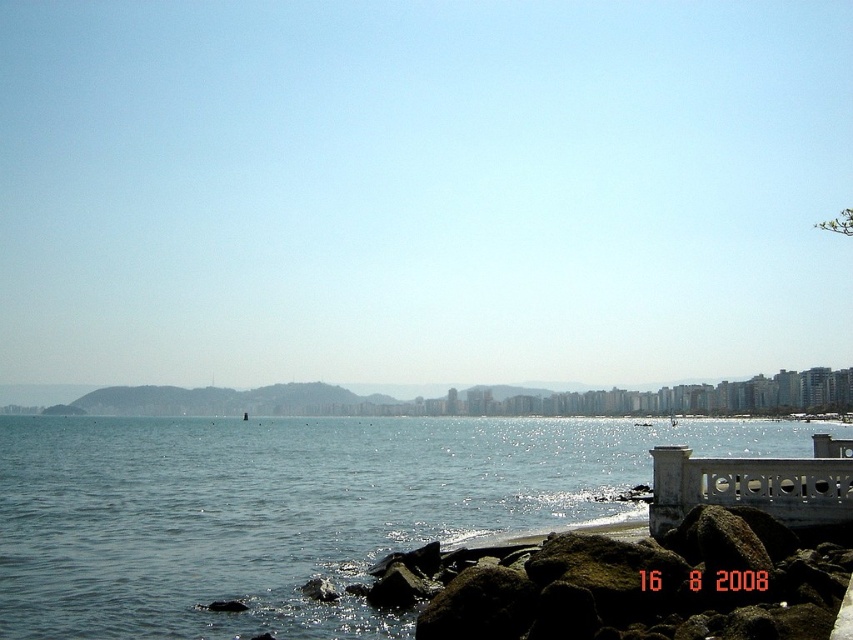
Question: Is blue water at center positioned behind brown rough rocks at lower right?

Choices:
 (A) no
 (B) yes

Answer: (B)

Question: Does blue water at center appear over brown rough rocks at lower right?

Choices:
 (A) no
 (B) yes

Answer: (A)

Question: Does blue water at center have a smaller size compared to brown rough rocks at lower right?

Choices:
 (A) no
 (B) yes

Answer: (A)